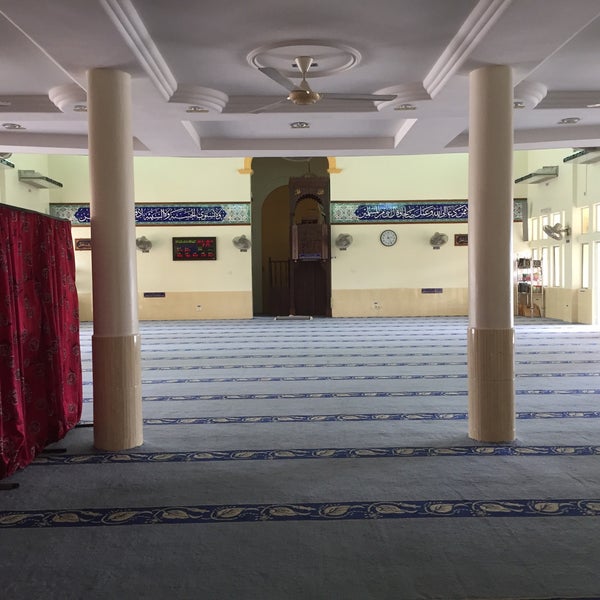
Locate an element on the screen. Image resolution: width=600 pixels, height=600 pixels. painting is located at coordinates (399, 228).